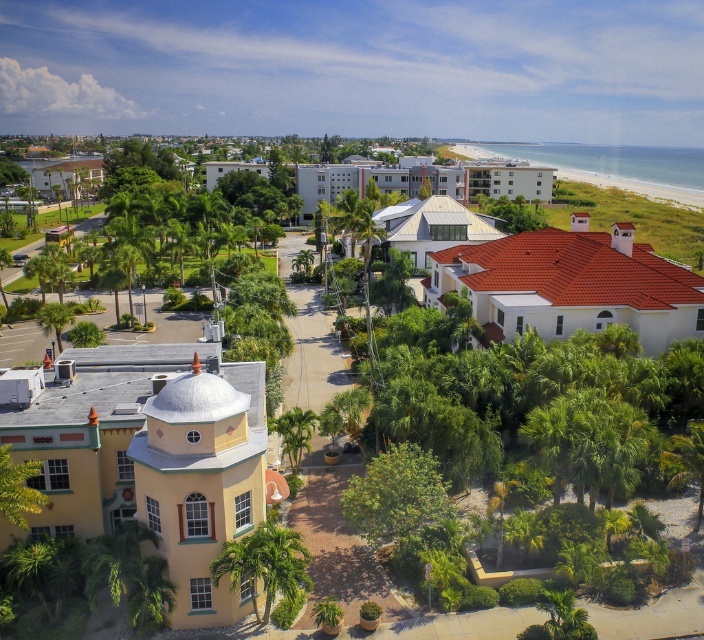
You are standing at the point marked as point (372, 179). Which building are you in front of?

You are in front of the white concrete building at center located at point (372, 179).

You are standing at the center of the coastal scene and want to take a photo of the white tile roof at upper right without the green leafy palm tree at lower left blocking the view. Is it possible?

The white tile roof at upper right is positioned over the green leafy palm tree at lower left, so taking a photo of the white tile roof at upper right without the green leafy palm tree at lower left blocking the view is possible because the roof is above the palm tree.